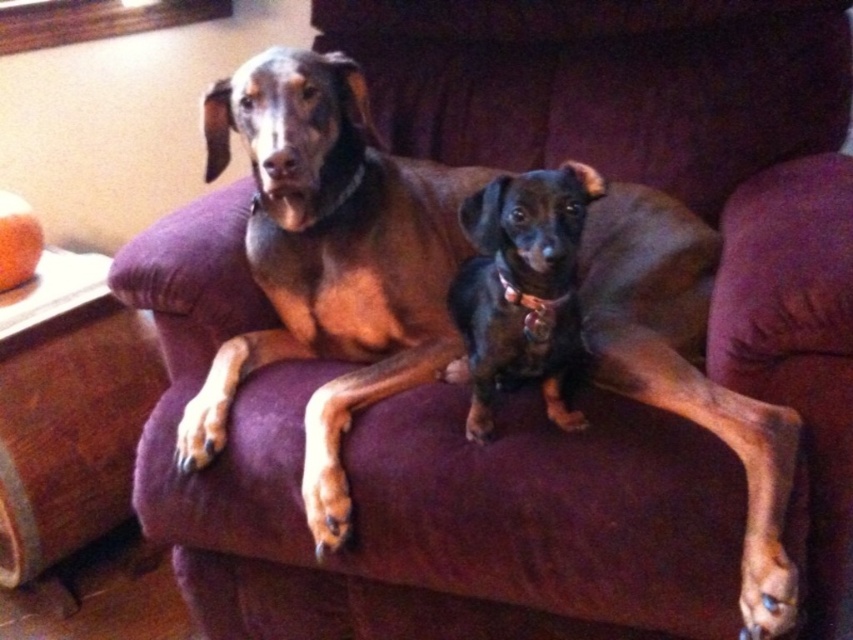
Between brown smooth coat dog at center and black shiny dog at center, which one has less height?

black shiny dog at center is shorter.

Between brown smooth coat dog at center and black shiny dog at center, which one has more height?

With more height is brown smooth coat dog at center.

This screenshot has height=640, width=853. In order to click on brown smooth coat dog at center in this screenshot , I will do `click(331, 260)`.